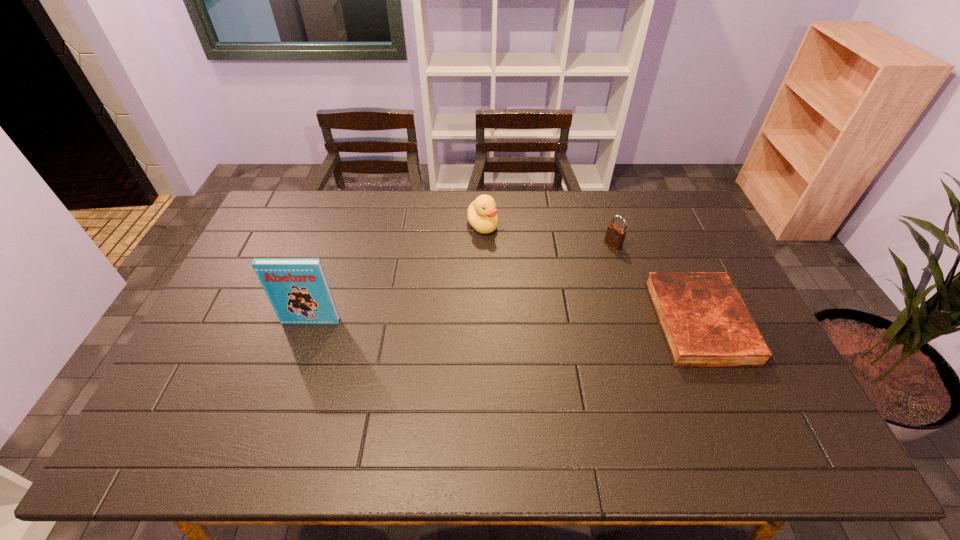
Where is `free space on the desktop that is between the leftmost object and the Bible and is positioned at the beak of the third object from right to left`? free space on the desktop that is between the leftmost object and the Bible and is positioned at the beak of the third object from right to left is located at coordinates [542, 322].

The width and height of the screenshot is (960, 540). I want to click on vacant spot on the desktop that is between the leftmost object and the Bible and is positioned on the front-facing side of the padlock, so click(x=516, y=322).